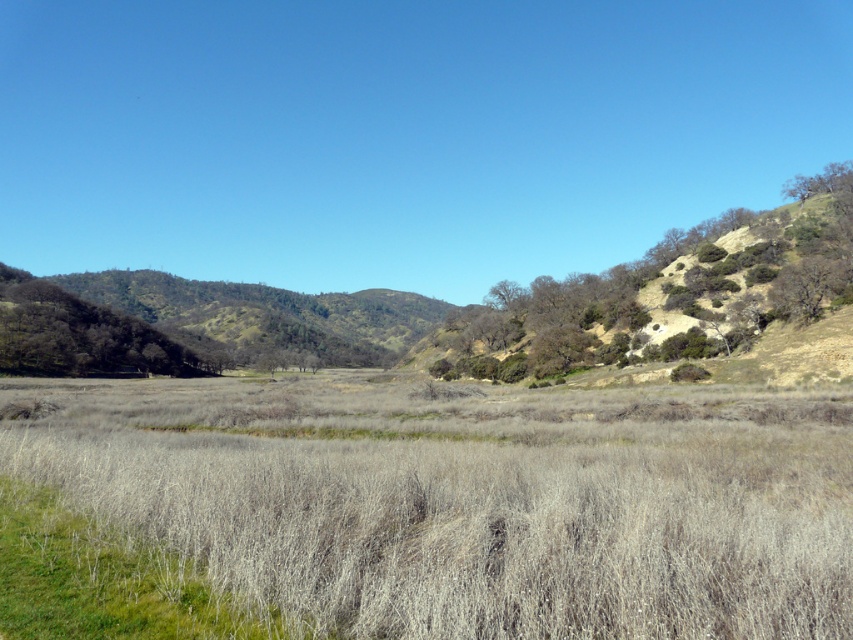
Question: Among these points, which one is farthest from the camera?

Choices:
 (A) (764, 280)
 (B) (206, 365)

Answer: (B)

Question: Can you confirm if green leafy tree at right is positioned to the right of green leafy tree at left?

Choices:
 (A) no
 (B) yes

Answer: (B)

Question: Does green leafy tree at right have a smaller size compared to green leafy tree at left?

Choices:
 (A) yes
 (B) no

Answer: (B)

Question: Which point is closer to the camera?

Choices:
 (A) (506, 332)
 (B) (47, 304)

Answer: (A)

Question: Is green leafy tree at right below green leafy tree at left?

Choices:
 (A) no
 (B) yes

Answer: (A)